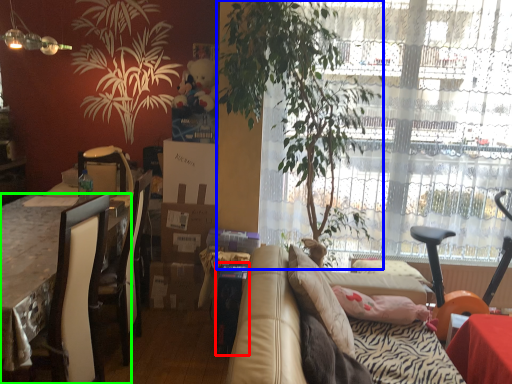
Question: Which object is positioned farthest from box (highlighted by a red box)? Select from houseplant (highlighted by a blue box) and desk (highlighted by a green box).

Choices:
 (A) houseplant
 (B) desk

Answer: (B)